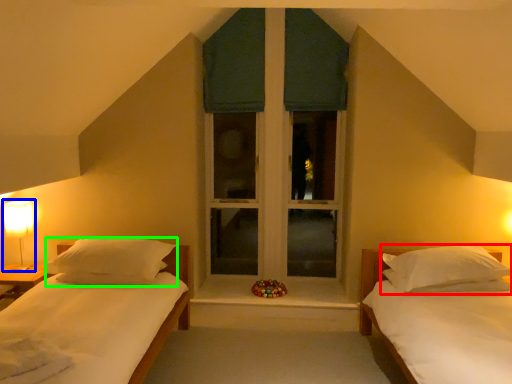
Question: Which object is positioned farthest from pillow (highlighted by a red box)? Select from table lamp (highlighted by a blue box) and pillow (highlighted by a green box).

Choices:
 (A) table lamp
 (B) pillow

Answer: (A)